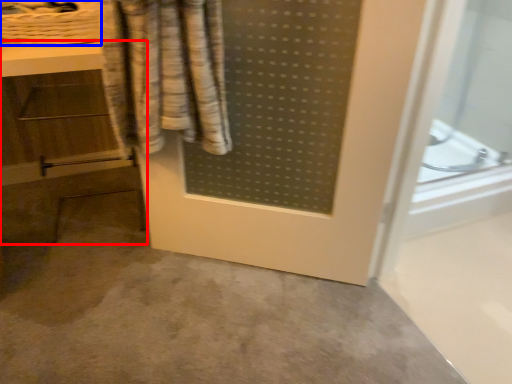
Question: Which point is further to the camera, vanity (highlighted by a red box) or basket (highlighted by a blue box)?

Choices:
 (A) vanity
 (B) basket

Answer: (B)